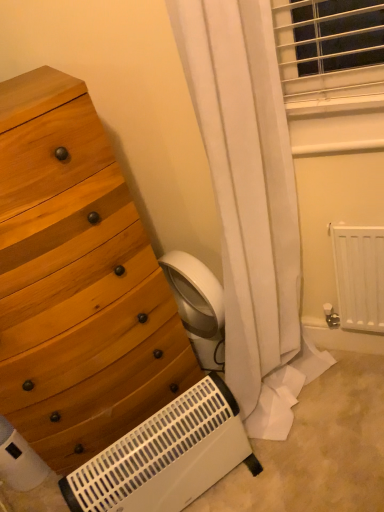
Question: Is white matte radiator at lower right at the back of wooden chest of drawers at left?

Choices:
 (A) yes
 (B) no

Answer: (B)

Question: Is wooden chest of drawers at left outside white matte radiator at lower right?

Choices:
 (A) no
 (B) yes

Answer: (B)

Question: Does wooden chest of drawers at left have a greater width compared to white matte radiator at lower right?

Choices:
 (A) no
 (B) yes

Answer: (B)

Question: Is white matte radiator at lower right surrounded by wooden chest of drawers at left?

Choices:
 (A) yes
 (B) no

Answer: (B)

Question: From a real-world perspective, is wooden chest of drawers at left located beneath white matte radiator at lower right?

Choices:
 (A) yes
 (B) no

Answer: (B)

Question: In the image, is white matte radiator at lower right on the left side or the right side of wooden chest of drawers at left?

Choices:
 (A) left
 (B) right

Answer: (B)

Question: Is white matte radiator at lower right taller or shorter than wooden chest of drawers at left?

Choices:
 (A) short
 (B) tall

Answer: (A)

Question: Is white matte radiator at lower right spatially inside wooden chest of drawers at left, or outside of it?

Choices:
 (A) inside
 (B) outside

Answer: (B)

Question: Based on their sizes in the image, would you say white matte radiator at lower right is bigger or smaller than wooden chest of drawers at left?

Choices:
 (A) big
 (B) small

Answer: (B)

Question: Considering the positions of white plastic heater at lower center and white matte radiator at lower right in the image, is white plastic heater at lower center bigger or smaller than white matte radiator at lower right?

Choices:
 (A) small
 (B) big

Answer: (B)

Question: Is point (89, 488) closer or farther from the camera than point (344, 316)?

Choices:
 (A) closer
 (B) farther

Answer: (A)

Question: Would you say white plastic heater at lower center is inside or outside white matte radiator at lower right?

Choices:
 (A) inside
 (B) outside

Answer: (B)

Question: From a real-world perspective, is white plastic heater at lower center above or below white matte radiator at lower right?

Choices:
 (A) above
 (B) below

Answer: (B)

Question: In the image, is wooden chest of drawers at left positioned in front of or behind white matte radiator at lower right?

Choices:
 (A) front
 (B) behind

Answer: (A)

Question: Considering the positions of wooden chest of drawers at left and white matte radiator at lower right in the image, is wooden chest of drawers at left bigger or smaller than white matte radiator at lower right?

Choices:
 (A) big
 (B) small

Answer: (A)